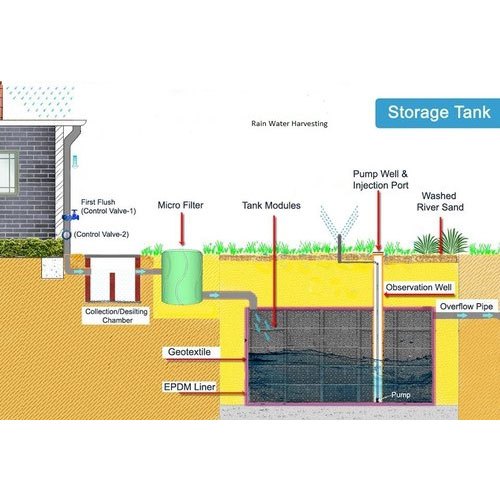
This screenshot has width=500, height=500. What are the coordinates of `brickwall` in the screenshot? It's located at (38, 213).